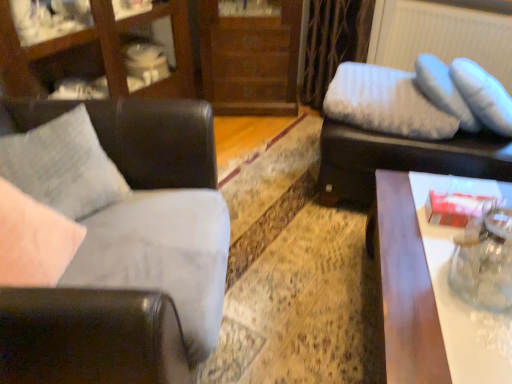
Question: Are wooden dresser at center and textured gray pillow at left, which is the 2th pillow in right-to-left order, far apart?

Choices:
 (A) no
 (B) yes

Answer: (B)

Question: Is wooden dresser at center behind textured gray pillow at left, marked as the 1th pillow in a front-to-back arrangement?

Choices:
 (A) no
 (B) yes

Answer: (B)

Question: From a real-world perspective, is wooden dresser at center below textured gray pillow at left, which is the 2th pillow in right-to-left order?

Choices:
 (A) no
 (B) yes

Answer: (B)

Question: Is wooden dresser at center to the right of textured gray pillow at left, the first pillow positioned from the left, from the viewer's perspective?

Choices:
 (A) no
 (B) yes

Answer: (B)

Question: Considering the relative sizes of wooden dresser at center and textured gray pillow at left, the first pillow positioned from the left, in the image provided, is wooden dresser at center thinner than textured gray pillow at left, the first pillow positioned from the left,?

Choices:
 (A) no
 (B) yes

Answer: (A)

Question: Considering the positions of matte black swivel chair at upper right and white glossy table at right in the image, is matte black swivel chair at upper right taller or shorter than white glossy table at right?

Choices:
 (A) tall
 (B) short

Answer: (B)

Question: Would you say matte black swivel chair at upper right is to the left or to the right of white glossy table at right in the picture?

Choices:
 (A) right
 (B) left

Answer: (A)

Question: Looking at their shapes, would you say matte black swivel chair at upper right is wider or thinner than white glossy table at right?

Choices:
 (A) thin
 (B) wide

Answer: (A)

Question: Relative to white glossy table at right, is matte black swivel chair at upper right in front or behind?

Choices:
 (A) behind
 (B) front

Answer: (A)

Question: Is white fluffy pillow at upper right, marked as the 1th pillow in a back-to-front arrangement, bigger or smaller than white glossy table at right?

Choices:
 (A) big
 (B) small

Answer: (B)

Question: Visually, is white fluffy pillow at upper right, marked as the 1th pillow in a back-to-front arrangement, positioned to the left or to the right of white glossy table at right?

Choices:
 (A) right
 (B) left

Answer: (B)

Question: Considering their positions, is white fluffy pillow at upper right, the second pillow when ordered from left to right, located in front of or behind white glossy table at right?

Choices:
 (A) front
 (B) behind

Answer: (B)

Question: Is white fluffy pillow at upper right, arranged as the first pillow when viewed from the right, wider or thinner than white glossy table at right?

Choices:
 (A) thin
 (B) wide

Answer: (A)

Question: Is matte black swivel chair at upper right situated inside textured gray pillow at left, which is the 2th pillow in right-to-left order, or outside?

Choices:
 (A) outside
 (B) inside

Answer: (A)

Question: Looking at their shapes, would you say matte black swivel chair at upper right is wider or thinner than textured gray pillow at left, which is the 2th pillow in right-to-left order?

Choices:
 (A) wide
 (B) thin

Answer: (A)